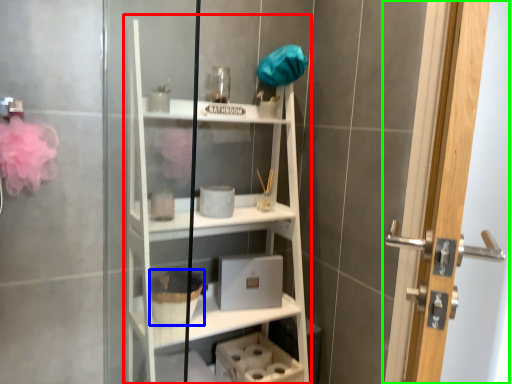
Question: Which object is the farthest from bookshelf (highlighted by a red box)? Choose among these: basket (highlighted by a blue box) or door (highlighted by a green box).

Choices:
 (A) basket
 (B) door

Answer: (B)